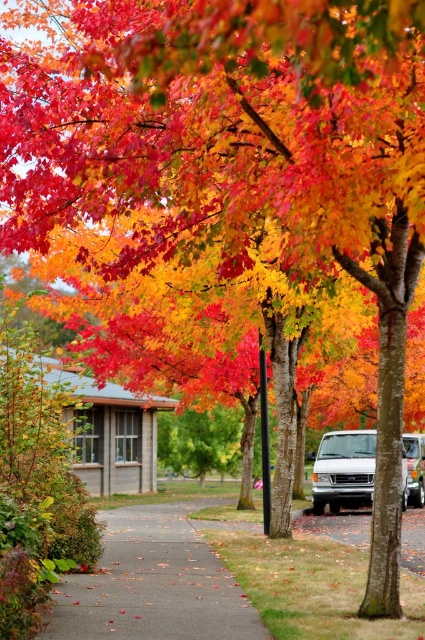
You are standing at the start of the pathway and want to reach the small building on the left. Which object should you walk around first, the gray concrete sidewalk at center or the white matte van at center?

You should walk around the gray concrete sidewalk at center first because it is in front of the white matte van at center, meaning the sidewalk is closer to you.

You are a delivery driver approaching the gray concrete sidewalk at center and the white matte van at center. Which one is narrower?

The gray concrete sidewalk at center is thinner than the white matte van at center, so the gray concrete sidewalk at center is narrower.